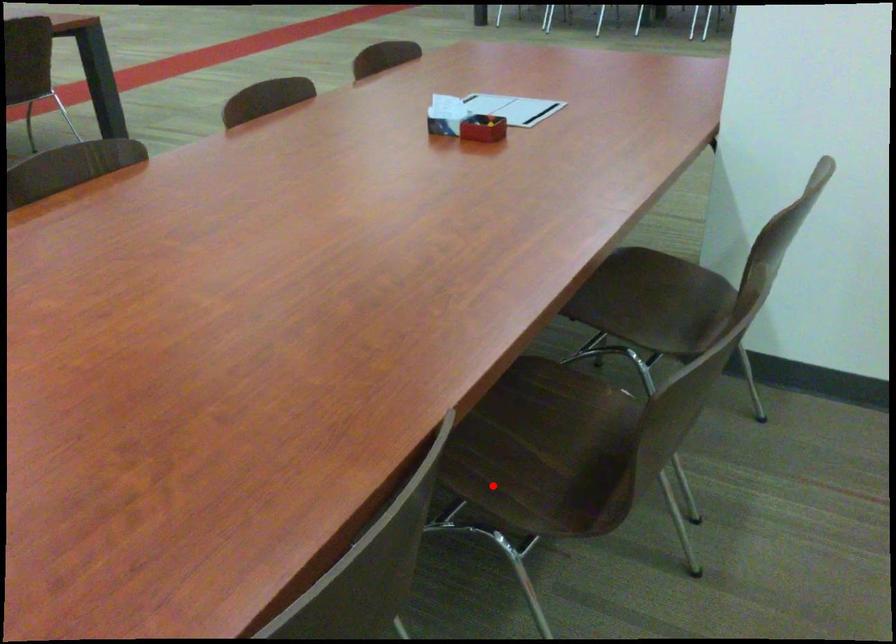
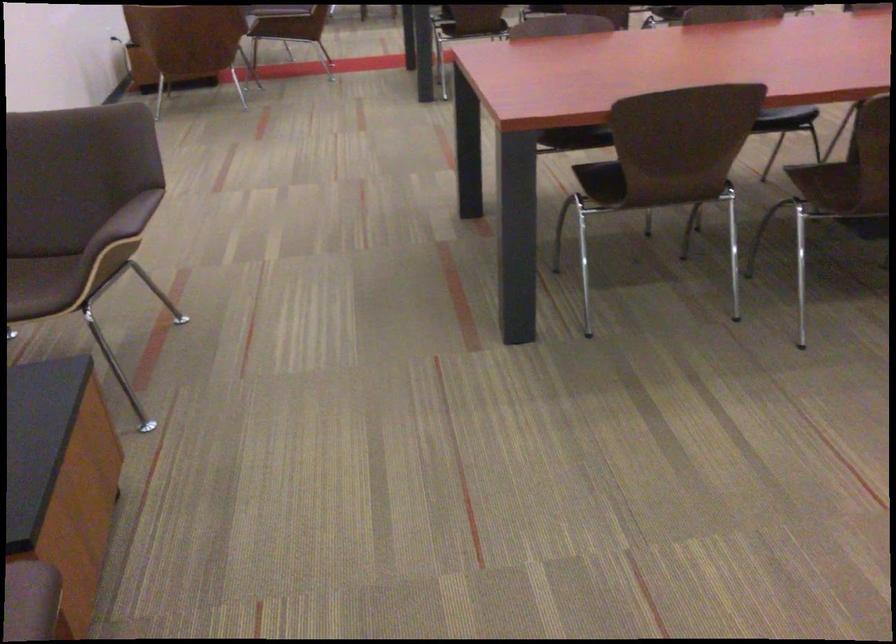
Where in the second image is the point corresponding to the highlighted location from the first image?

(819, 183)